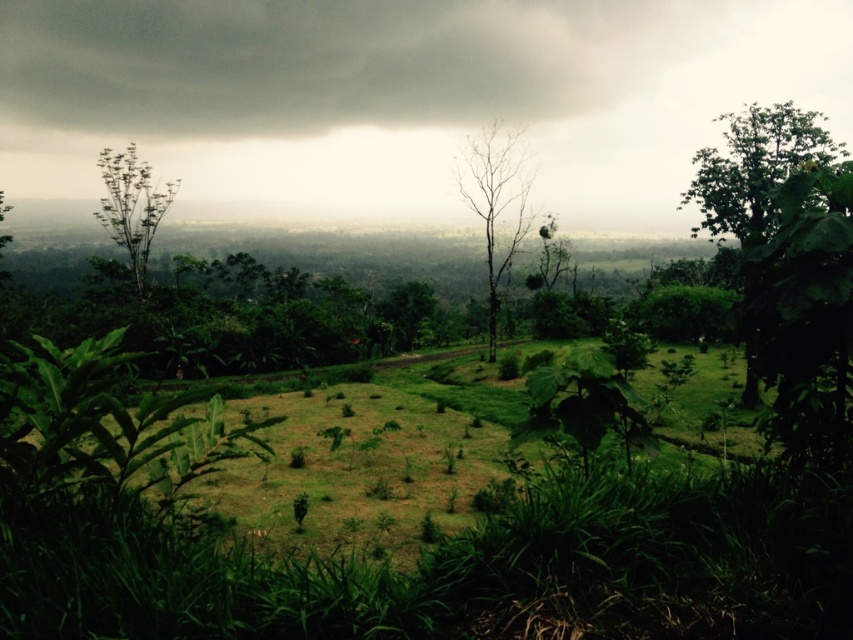
Is green leafy tree at right taller than green leafy tree at left?

Indeed, green leafy tree at right has a greater height compared to green leafy tree at left.

Does green leafy tree at right appear over green leafy tree at left?

Yes, green leafy tree at right is above green leafy tree at left.

Describe the element at coordinates (753, 166) in the screenshot. The image size is (853, 640). I see `green leafy tree at right` at that location.

Image resolution: width=853 pixels, height=640 pixels. I want to click on green leafy tree at right, so click(x=753, y=166).

Between green leafy tree at right and bare wood tree at center, which one appears on the left side from the viewer's perspective?

bare wood tree at center

Who is taller, green leafy tree at right or bare wood tree at center?

With more height is green leafy tree at right.

Identify the location of green leafy tree at right. coord(753,166).

Where is `green leafy tree at right`? green leafy tree at right is located at coordinates (753, 166).

Is bare wood tree at center further to camera compared to green leafy tree at left?

That is False.

Is bare wood tree at center in front of green leafy tree at left?

Yes, bare wood tree at center is in front of green leafy tree at left.

Who is more forward, [514,202] or [102,205]?

Point [514,202] is more forward.

Find the location of a particular element. This screenshot has width=853, height=640. bare wood tree at center is located at coordinates (496, 204).